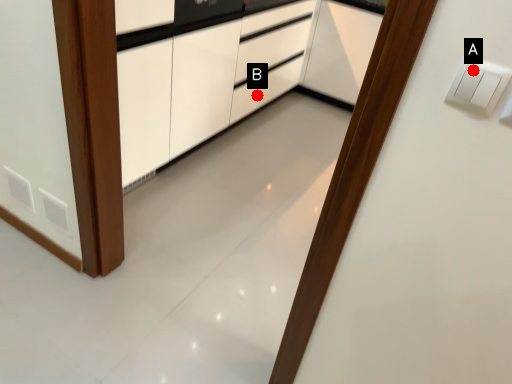
Question: Two points are circled on the image, labeled by A and B beside each circle. Among these points, which one is nearest to the camera?

Choices:
 (A) A is closer
 (B) B is closer

Answer: (A)